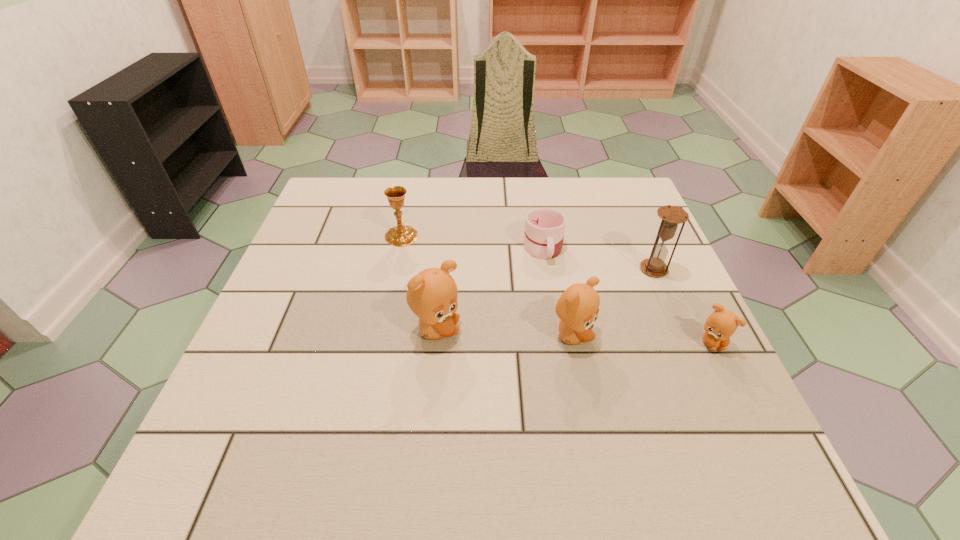
Identify the location of free space located on the back of the hourglass. (614, 177).

I want to click on free point located on the side with the handle of the shortest object, so click(x=550, y=288).

Image resolution: width=960 pixels, height=540 pixels. What are the coordinates of `free space located on the right of the leftmost object` in the screenshot? It's located at 444,237.

You are a GUI agent. You are given a task and a screenshot of the screen. Output one action in this format:
    pyautogui.click(x=<x>, y=<y>)
    Task: Click on the teddy bear that is at the right edge
    
    Given the screenshot: What is the action you would take?
    pyautogui.click(x=722, y=323)

You are a GUI agent. You are given a task and a screenshot of the screen. Output one action in this format:
    pyautogui.click(x=<x>, y=<y>)
    Task: Click on the hourglass present at the right edge
    This screenshot has height=540, width=960.
    Given the screenshot: What is the action you would take?
    pyautogui.click(x=672, y=216)

Locate an element on the screen. The width and height of the screenshot is (960, 540). vacant space at the far edge is located at coordinates (412, 213).

Find the location of a particular element. vacant space at the near edge of the desktop is located at coordinates (333, 409).

In order to click on free region at the left edge of the desktop in this screenshot , I will do `click(252, 373)`.

Locate an element on the screen. free space at the right edge of the desktop is located at coordinates click(x=654, y=323).

What are the coordinates of `vacant space at the far left corner of the desktop` in the screenshot? It's located at (352, 224).